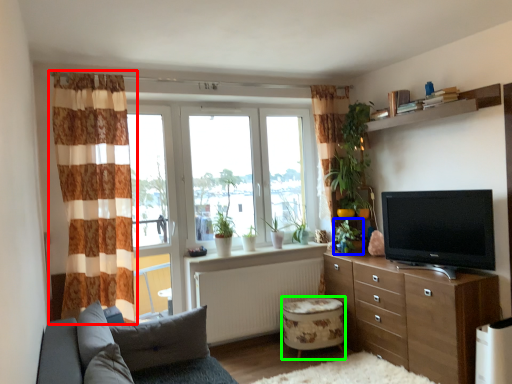
Question: Which is farther away from curtain (highlighted by a red box)? plant (highlighted by a blue box) or stool (highlighted by a green box)?

Choices:
 (A) plant
 (B) stool

Answer: (A)